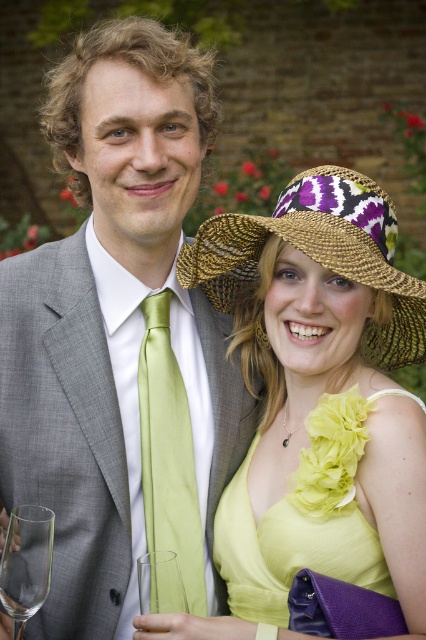
Question: Where is braided straw hat at upper right located in relation to satin green tie at center in the image?

Choices:
 (A) left
 (B) right

Answer: (B)

Question: Can you confirm if matte yellow dress at center is positioned to the left of clear glass wine glass at lower left?

Choices:
 (A) no
 (B) yes

Answer: (A)

Question: Estimate the real-world distances between objects in this image. Which object is closer to the satin green tie at center?

Choices:
 (A) transparent glass at lower left
 (B) clear glass wine glass at lower left
 (C) braided straw hat at upper right
 (D) yellow chiffon dress at center

Answer: (D)

Question: Estimate the real-world distances between objects in this image. Which object is closer to the satin green tie at center?

Choices:
 (A) matte gray suit at center
 (B) transparent glass at lower left
 (C) yellow chiffon dress at center
 (D) clear glass wine glass at lower left

Answer: (A)

Question: Is transparent glass at lower left to the left of clear glass wine glass at lower left from the viewer's perspective?

Choices:
 (A) yes
 (B) no

Answer: (A)

Question: Among these points, which one is nearest to the camera?

Choices:
 (A) (152, 564)
 (B) (374, 540)

Answer: (A)